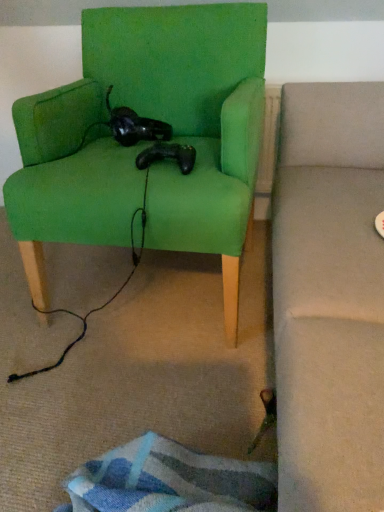
Question: Which is correct: green fabric chair at center is inside black matte controller at center, or outside of it?

Choices:
 (A) inside
 (B) outside

Answer: (B)

Question: From their relative heights in the image, would you say green fabric chair at center is taller or shorter than black matte controller at center?

Choices:
 (A) tall
 (B) short

Answer: (A)

Question: Would you say green fabric chair at center is to the left or to the right of black matte controller at center in the picture?

Choices:
 (A) right
 (B) left

Answer: (B)

Question: Based on their positions, is black matte controller at center located to the left or right of green fabric chair at center?

Choices:
 (A) right
 (B) left

Answer: (A)

Question: From the image's perspective, is black matte controller at center above or below green fabric chair at center?

Choices:
 (A) above
 (B) below

Answer: (B)

Question: Is point (150, 153) positioned closer to the camera than point (89, 99)?

Choices:
 (A) closer
 (B) farther

Answer: (A)

Question: Would you say black matte controller at center is inside or outside green fabric chair at center?

Choices:
 (A) inside
 (B) outside

Answer: (A)